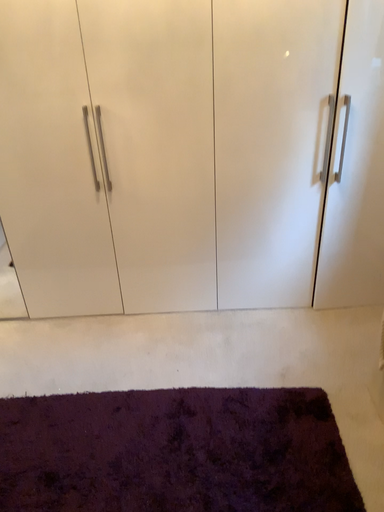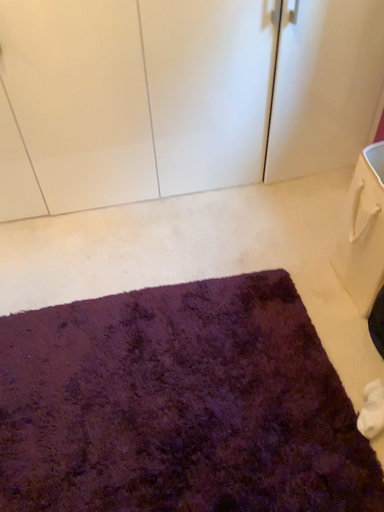
Question: Which way did the camera rotate in the video?

Choices:
 (A) rotated right
 (B) rotated left

Answer: (A)